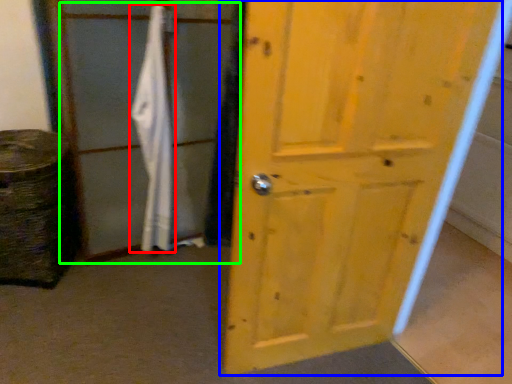
Question: Estimate the real-world distances between objects in this image. Which object is closer to bath towel (highlighted by a red box), door (highlighted by a blue box) or screen door (highlighted by a green box)?

Choices:
 (A) door
 (B) screen door

Answer: (B)